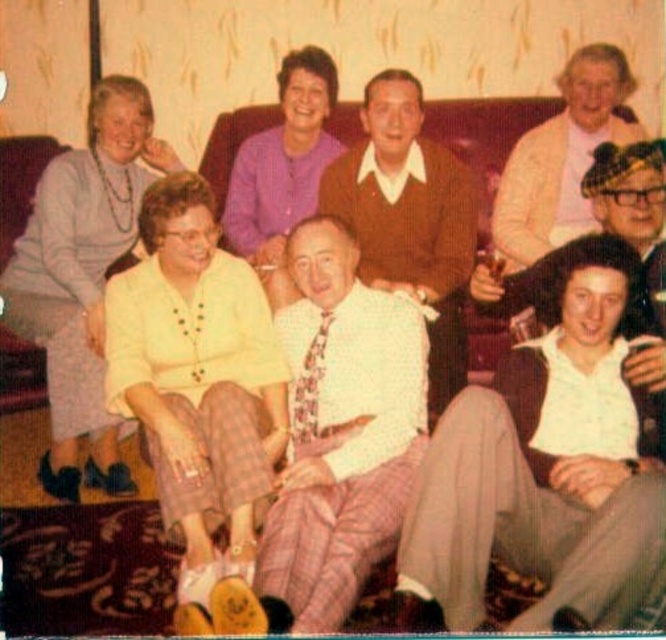
Question: Does yellow fabric blouse at center appear under purple knitwear at upper center?

Choices:
 (A) no
 (B) yes

Answer: (B)

Question: Among these objects, which one is nearest to the camera?

Choices:
 (A) purple knitwear at upper center
 (B) white textured shirt at center

Answer: (B)

Question: Is brown sweater at center smaller than light beige sweater at upper right?

Choices:
 (A) yes
 (B) no

Answer: (B)

Question: Based on their relative distances, which object is farther from the clear plastic cup at center right?

Choices:
 (A) brown sweater at center
 (B) white cotton shirt at lower right
 (C) purple knitwear at upper center
 (D) white textured shirt at center

Answer: (C)

Question: Which point appears closest to the camera in this image?

Choices:
 (A) (242, 240)
 (B) (35, 305)
 (C) (396, 433)
 (D) (121, 390)

Answer: (C)

Question: Can you confirm if white cotton shirt at lower right is positioned to the left of light beige sweater at upper right?

Choices:
 (A) no
 (B) yes

Answer: (B)